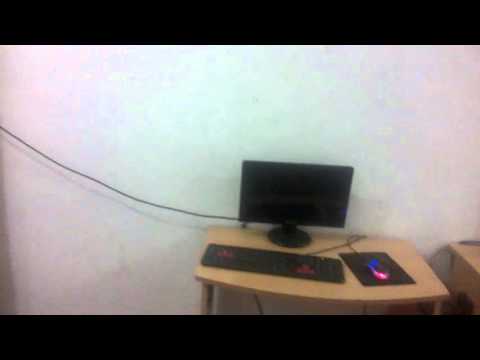
Identify the location of table. (432, 283).